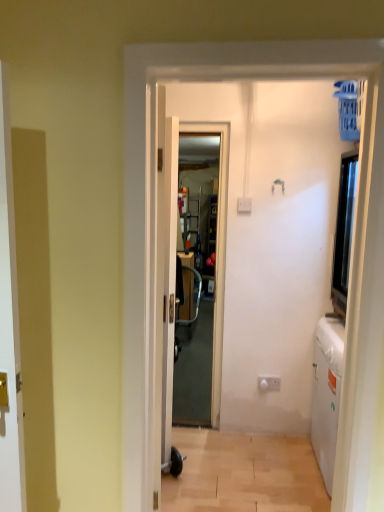
Question: Is point (278, 391) positioned closer to the camera than point (225, 144)?

Choices:
 (A) farther
 (B) closer

Answer: (A)

Question: Considering the positions of white glossy electric outlet at lower center and transparent plastic screen door at center in the image, is white glossy electric outlet at lower center bigger or smaller than transparent plastic screen door at center?

Choices:
 (A) big
 (B) small

Answer: (B)

Question: Which object is the farthest from the transparent plastic screen door at center?

Choices:
 (A) white glossy electric outlet at lower center
 (B) light brown wood floor at lower center
 (C) white glossy door at center

Answer: (A)

Question: Which object is the farthest from the white glossy electric outlet at lower center?

Choices:
 (A) light brown wood floor at lower center
 (B) transparent plastic screen door at center
 (C) white glossy door at center

Answer: (C)